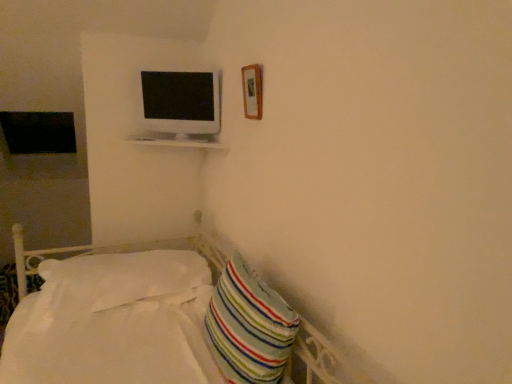
Question: From a real-world perspective, is white soft pillow at lower left, marked as the 1th pillow in a back-to-front arrangement, above or below striped fabric pillow at lower right, which is the first pillow in right-to-left order?

Choices:
 (A) below
 (B) above

Answer: (A)

Question: Considering the positions of white soft pillow at lower left, positioned as the second pillow in front-to-back order, and striped fabric pillow at lower right, which is counted as the first pillow, starting from the front, in the image, is white soft pillow at lower left, positioned as the second pillow in front-to-back order, taller or shorter than striped fabric pillow at lower right, which is counted as the first pillow, starting from the front,?

Choices:
 (A) tall
 (B) short

Answer: (B)

Question: Estimate the real-world distances between objects in this image. Which object is closer to the striped fabric pillow at lower right, the second pillow when ordered from back to front?

Choices:
 (A) white glossy monitor at upper center
 (B) wooden frame at upper right
 (C) white soft pillow at lower left, the second pillow when ordered from right to left

Answer: (C)

Question: Which object is the closest to the striped fabric pillow at lower right, marked as the second pillow in a left-to-right arrangement?

Choices:
 (A) white soft pillow at lower left, positioned as the second pillow in front-to-back order
 (B) wooden frame at upper right
 (C) white glossy monitor at upper center

Answer: (A)